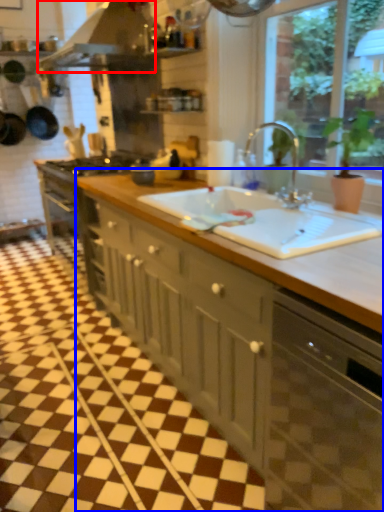
Question: Which point is closer to the camera, exhaust hood (highlighted by a red box) or cabinetry (highlighted by a blue box)?

Choices:
 (A) exhaust hood
 (B) cabinetry

Answer: (B)